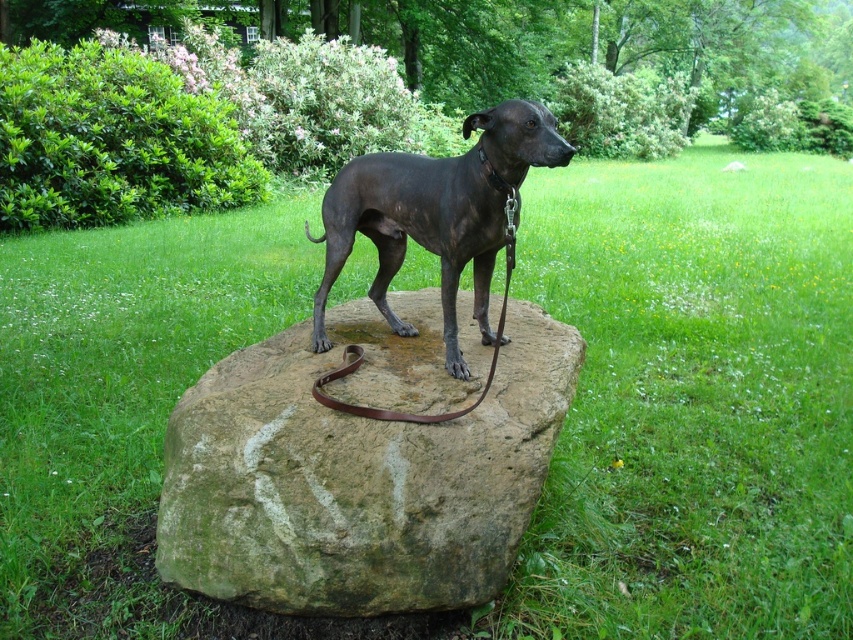
Question: Which point is closer to the camera?

Choices:
 (A) brown leather leash at center
 (B) shiny black dog at center

Answer: (B)

Question: Which of these objects is positioned closest to the brown leather leash at center?

Choices:
 (A) shiny black dog at center
 (B) green mossy rock at center

Answer: (B)

Question: Which of these objects is positioned closest to the brown leather leash at center?

Choices:
 (A) shiny black dog at center
 (B) green mossy rock at center

Answer: (B)

Question: Does green mossy rock at center appear on the right side of brown leather leash at center?

Choices:
 (A) yes
 (B) no

Answer: (B)

Question: Can you confirm if green mossy rock at center is positioned below brown leather leash at center?

Choices:
 (A) no
 (B) yes

Answer: (B)

Question: Does green mossy rock at center have a larger size compared to shiny black dog at center?

Choices:
 (A) yes
 (B) no

Answer: (A)